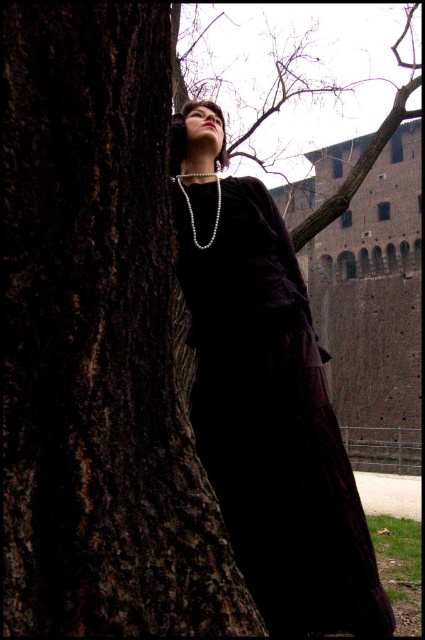
You are a photographer trying to capture the velvet dark dress at center and the dark brown rough tree trunk at left in the same frame. Based on their sizes in the image, which object would appear larger in your photo?

The dark brown rough tree trunk at left appears larger than the velvet dark dress at center because it is taller.

You are a photographer trying to capture the velvet dark dress at center and the dark brown rough tree trunk at left in the same frame. Based on their sizes, which object would appear larger in your photo?

The velvet dark dress at center would appear larger in the photo because it is bigger than the dark brown rough tree trunk at left.

You are a photographer trying to capture the velvet dark dress at center without the dark brown rough tree trunk at left blocking the view. Based on their positions, can you move to the right to frame the dress without the tree trunk in the shot?

The dark brown rough tree trunk at left is positioned on the left side of the velvet dark dress at center, so moving to the right might still keep the tree trunk in the frame. To avoid it, you should move to the right and ensure the camera angle does not include the left side where the tree trunk is located.